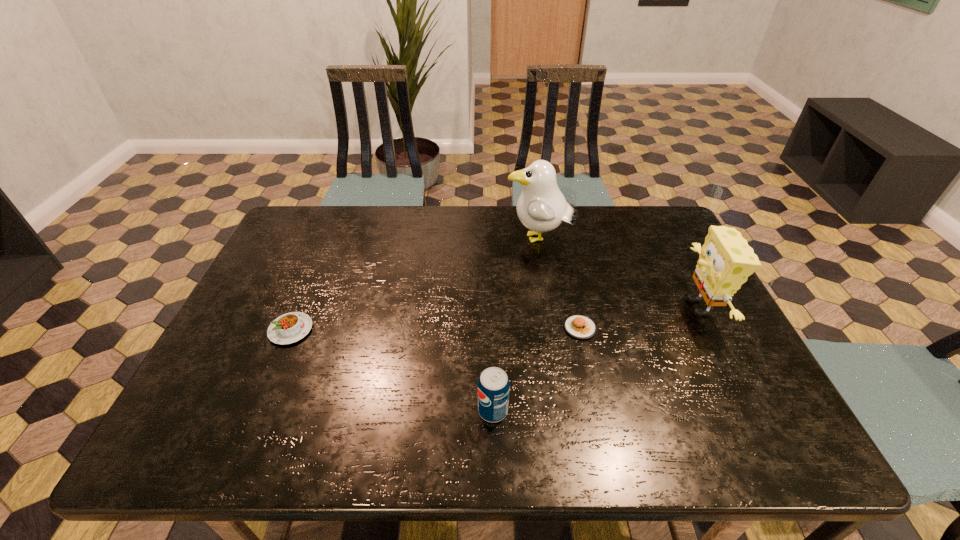
Locate an element on the screen. free point between the pop and the second tallest object is located at coordinates (596, 359).

I want to click on vacant space that's between the gull and the pudding, so click(x=415, y=285).

Identify the location of blank region between the tallest object and the food. (560, 284).

The height and width of the screenshot is (540, 960). In order to click on vacant space in between the rightmost object and the tallest object in this screenshot , I will do click(x=619, y=273).

At what (x,y) coordinates should I click in order to perform the action: click on vacant region between the tallest object and the nearest object. Please return your answer as a coordinate pair (x, y). Looking at the image, I should click on (516, 325).

At what (x,y) coordinates should I click in order to perform the action: click on free space that is in between the food and the leftmost object. Please return your answer as a coordinate pair (x, y). This screenshot has width=960, height=540. Looking at the image, I should click on (436, 329).

Locate an element on the screen. This screenshot has height=540, width=960. vacant region between the second shortest object and the second tallest object is located at coordinates (495, 319).

Locate which object is the third closest to the farthest object. Please provide its 2D coordinates. Your answer should be formatted as a tuple, i.e. [(x, y)], where the tuple contains the x and y coordinates of a point satisfying the conditions above.

[(493, 385)]

This screenshot has height=540, width=960. What are the coordinates of `object identified as the closest to the shortest object` in the screenshot? It's located at (493, 385).

Locate an element on the screen. blank space that satisfies the following two spatial constraints: 1. on the face of the sponge; 2. on the front side of the shortest object is located at coordinates (709, 328).